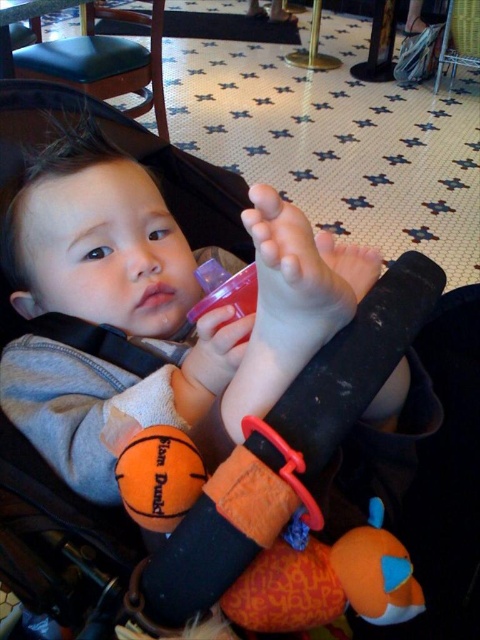
Question: Which point is farther to the camera?

Choices:
 (A) orange plush toy at center
 (B) matte gray baby at center

Answer: (A)

Question: Among these objects, which one is farthest from the camera?

Choices:
 (A) matte gray baby at center
 (B) orange plush toy at center

Answer: (B)

Question: Is matte gray baby at center wider than orange plush toy at center?

Choices:
 (A) yes
 (B) no

Answer: (A)

Question: Is matte gray baby at center positioned behind orange plush toy at center?

Choices:
 (A) yes
 (B) no

Answer: (B)

Question: Which object appears closest to the camera in this image?

Choices:
 (A) matte gray baby at center
 (B) orange plush toy at center

Answer: (A)

Question: Does matte gray baby at center appear under orange plush toy at center?

Choices:
 (A) yes
 (B) no

Answer: (B)